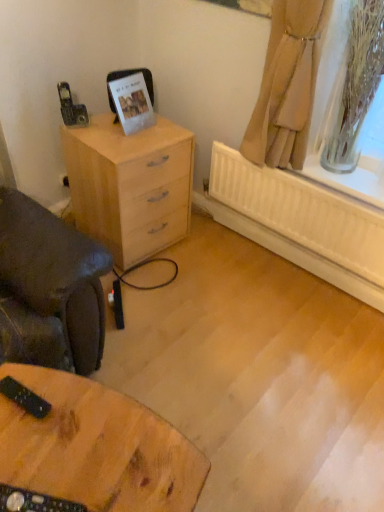
Question: Is beige fabric curtain at upper right oriented away from wooden table at lower left?

Choices:
 (A) no
 (B) yes

Answer: (A)

Question: From the image's perspective, is beige fabric curtain at upper right beneath wooden table at lower left?

Choices:
 (A) yes
 (B) no

Answer: (B)

Question: Could you tell me if beige fabric curtain at upper right is turned towards wooden table at lower left?

Choices:
 (A) no
 (B) yes

Answer: (B)

Question: Considering the relative sizes of beige fabric curtain at upper right and wooden table at lower left in the image provided, is beige fabric curtain at upper right bigger than wooden table at lower left?

Choices:
 (A) no
 (B) yes

Answer: (A)

Question: Could wooden table at lower left be considered to be inside beige fabric curtain at upper right?

Choices:
 (A) no
 (B) yes

Answer: (A)

Question: Is beige fabric curtain at upper right at the right side of wooden table at lower left?

Choices:
 (A) yes
 (B) no

Answer: (A)

Question: Can you confirm if wooden table at lower left is thinner than beige fabric curtain at upper right?

Choices:
 (A) no
 (B) yes

Answer: (A)

Question: Is wooden table at lower left to the left of beige fabric curtain at upper right from the viewer's perspective?

Choices:
 (A) no
 (B) yes

Answer: (B)

Question: From the image's perspective, is wooden table at lower left located above beige fabric curtain at upper right?

Choices:
 (A) no
 (B) yes

Answer: (A)

Question: Would you say wooden table at lower left contains beige fabric curtain at upper right?

Choices:
 (A) no
 (B) yes

Answer: (A)

Question: Considering the relative sizes of wooden table at lower left and beige fabric curtain at upper right in the image provided, is wooden table at lower left wider than beige fabric curtain at upper right?

Choices:
 (A) no
 (B) yes

Answer: (B)

Question: Is wooden table at lower left beside beige fabric curtain at upper right?

Choices:
 (A) no
 (B) yes

Answer: (A)

Question: Is beige fabric curtain at upper right aimed at light wood chest of drawers at left?

Choices:
 (A) no
 (B) yes

Answer: (A)